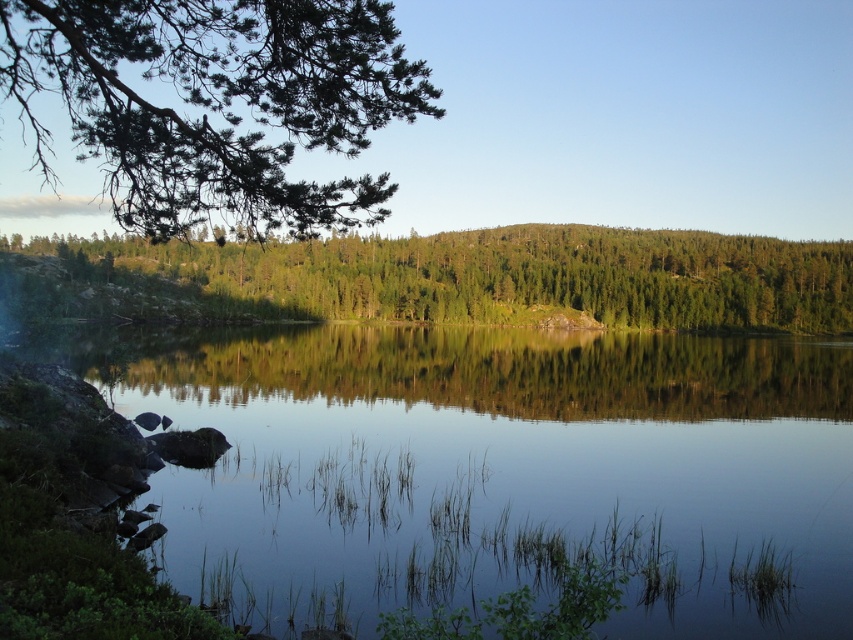
Question: Which is farther from the clear water at center?

Choices:
 (A) green needle-like branches at upper left
 (B) green matte tree at center

Answer: (B)

Question: Does clear water at center have a larger size compared to green needle-like branches at upper left?

Choices:
 (A) no
 (B) yes

Answer: (A)

Question: From the image, what is the correct spatial relationship of green needle-like branches at upper left in relation to green matte tree at center?

Choices:
 (A) right
 (B) left

Answer: (B)

Question: Which of these objects is positioned closest to the green needle-like branches at upper left?

Choices:
 (A) green matte tree at center
 (B) clear water at center

Answer: (B)

Question: Is green needle-like branches at upper left wider than green matte tree at center?

Choices:
 (A) yes
 (B) no

Answer: (B)

Question: Estimate the real-world distances between objects in this image. Which object is closer to the green needle-like branches at upper left?

Choices:
 (A) clear water at center
 (B) green matte tree at center

Answer: (A)